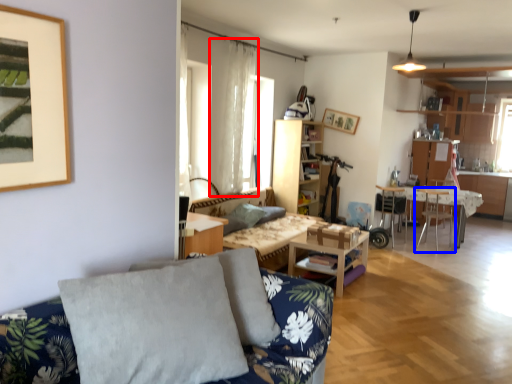
Question: Among these objects, which one is nearest to the camera, curtain (highlighted by a red box) or chair (highlighted by a blue box)?

Choices:
 (A) curtain
 (B) chair

Answer: (A)